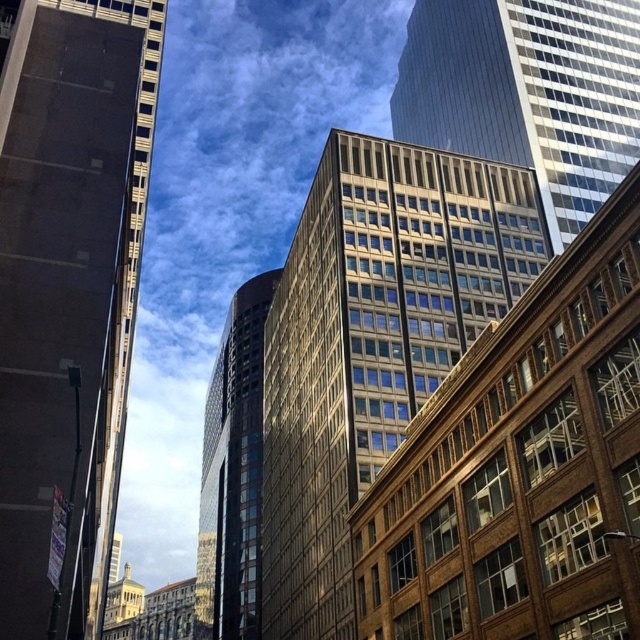
Does glassy reflective building at center come behind glassy reflective tower at center?

No, it is not.

This screenshot has width=640, height=640. Identify the location of glassy reflective building at center. (372, 342).

At what (x,y) coordinates should I click in order to perform the action: click on glassy reflective building at center. Please return your answer as a coordinate pair (x, y). Image resolution: width=640 pixels, height=640 pixels. Looking at the image, I should click on (372, 342).

Does dark glass skyscraper at left have a lesser height compared to glassy reflective building at center?

In fact, dark glass skyscraper at left may be taller than glassy reflective building at center.

Measure the distance between point (49, 252) and camera.

A distance of 30.56 meters exists between point (49, 252) and camera.

Locate an element on the screen. The width and height of the screenshot is (640, 640). dark glass skyscraper at left is located at coordinates (67, 292).

Which of these two, dark glass skyscraper at left or glassy reflective skyscraper at center, stands shorter?

glassy reflective skyscraper at center

How distant is dark glass skyscraper at left from glassy reflective skyscraper at center?

dark glass skyscraper at left is 64.69 meters away from glassy reflective skyscraper at center.

Which is behind, point (54, 356) or point (497, 144)?

Positioned behind is point (497, 144).

Where is `dark glass skyscraper at left`? dark glass skyscraper at left is located at coordinates (67, 292).